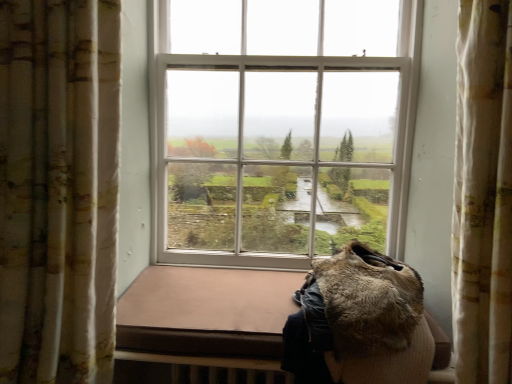
Question: Based on their sizes in the image, would you say furry brown coat at lower right is bigger or smaller than fluffy fabric curtain at left?

Choices:
 (A) small
 (B) big

Answer: (A)

Question: Is furry brown coat at lower right wider or thinner than fluffy fabric curtain at left?

Choices:
 (A) wide
 (B) thin

Answer: (A)

Question: In the image, is furry brown coat at lower right on the left side or the right side of fluffy fabric curtain at left?

Choices:
 (A) right
 (B) left

Answer: (A)

Question: In terms of width, does fluffy fabric curtain at left look wider or thinner when compared to furry brown coat at lower right?

Choices:
 (A) wide
 (B) thin

Answer: (B)

Question: Visually, is fluffy fabric curtain at left positioned to the left or to the right of furry brown coat at lower right?

Choices:
 (A) left
 (B) right

Answer: (A)

Question: Is point (41, 276) closer or farther from the camera than point (406, 362)?

Choices:
 (A) closer
 (B) farther

Answer: (A)

Question: In terms of height, does fluffy fabric curtain at left look taller or shorter compared to furry brown coat at lower right?

Choices:
 (A) short
 (B) tall

Answer: (B)